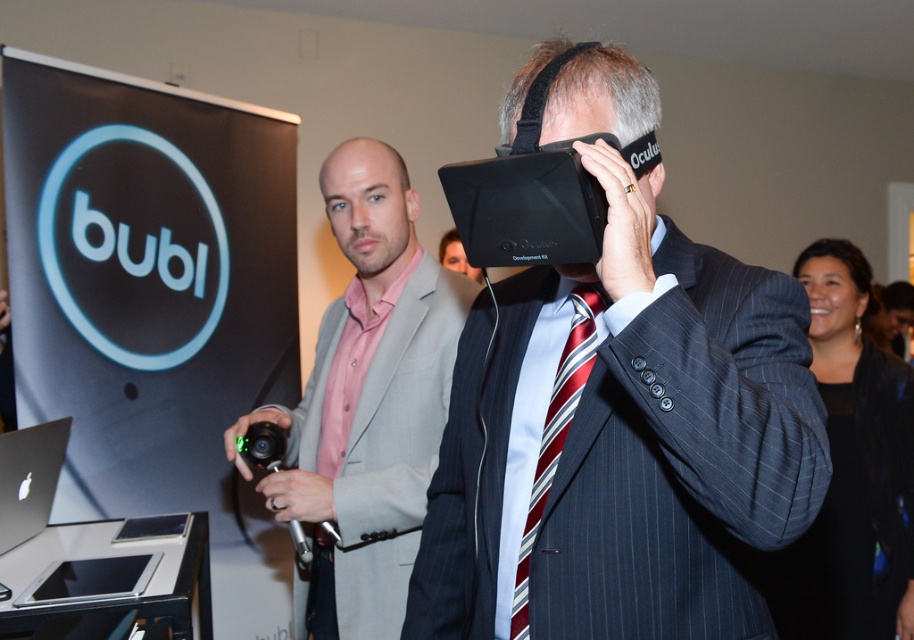
You are a photographer at the event and want to take a photo of the two objects mentioned. Since the matte black vr headset at center and the striped silk tie at center are in the same frame, which one will appear closer to the camera in the photo?

The matte black vr headset at center appears closer to the camera because it is in front of the striped silk tie at center in the scene.

You are organizing a tech event and need to place the matte black vr headset at center and the black matte laptop at lower left on a table. If the table has a width of 1.2 meters, can both items fit side by side without overlapping?

The matte black vr headset at center is wider than the black matte laptop at lower left. However, since the exact dimensions of each are not provided, we cannot definitively determine if they can fit side by side on a 1.2 meter table. More information about their individual widths is needed.